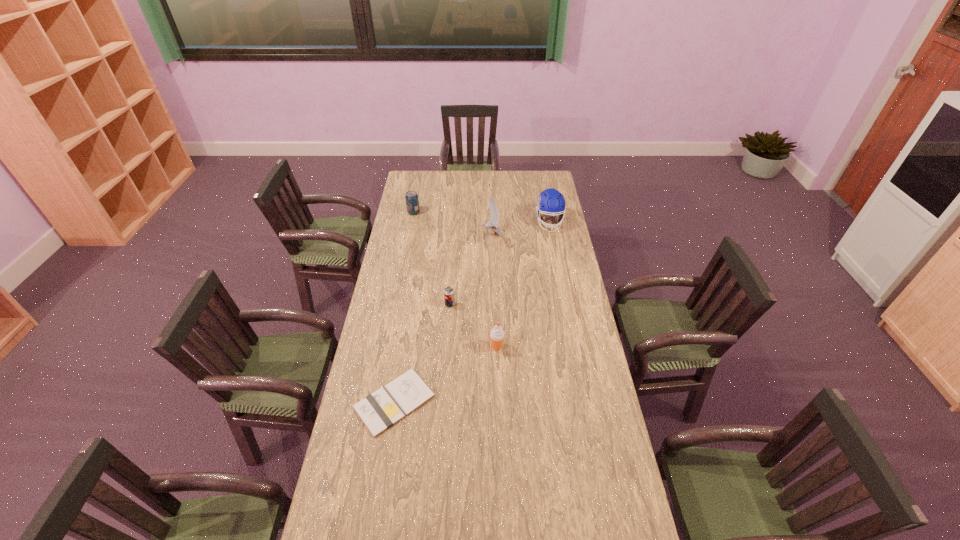
You are a GUI agent. You are given a task and a screenshot of the screen. Output one action in this format:
    pyautogui.click(x=<x>, y=<y>)
    Task: Click on the rightmost object
    The width and height of the screenshot is (960, 540).
    Given the screenshot: What is the action you would take?
    pyautogui.click(x=550, y=201)

Locate an element on the screen. This screenshot has width=960, height=540. gull is located at coordinates (494, 210).

Where is `the fifth farthest object`? Image resolution: width=960 pixels, height=540 pixels. the fifth farthest object is located at coordinates (497, 335).

Find the location of a particular element. pop soda is located at coordinates (412, 202).

I want to click on the fifth tallest object, so click(x=449, y=297).

Find the location of a particular element. beer can is located at coordinates (449, 297).

Locate an element on the screen. The image size is (960, 540). the shortest object is located at coordinates (378, 411).

This screenshot has width=960, height=540. I want to click on the nearest object, so [378, 411].

Where is `vacant space located on the face guard of the rightmost object`? vacant space located on the face guard of the rightmost object is located at coordinates (559, 272).

This screenshot has width=960, height=540. In order to click on vacant space located 0.200m at the tip of the beak of the gull in this screenshot , I will do `click(443, 235)`.